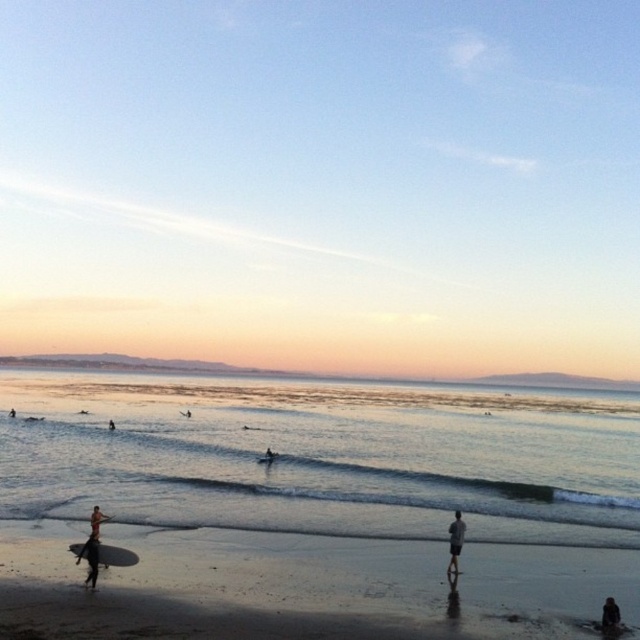
You are standing on the beach and see the dark gray fabric shorts at center and the dark gray wetsuit at lower left. Which object is positioned to the right of the other?

The dark gray fabric shorts at center is to the right of dark gray wetsuit at lower left.

You are standing on the beach and see two points marked on the sand. The first point is at coordinate point(x=272, y=456) and the second is at point(x=113, y=422). Which point is closer to you?

Point(x=272, y=456) is closer to the viewer than point(x=113, y=422).

You are a photographer trying to capture a shot of the dark gray fabric shorts at center and the brown surfboard at lower left. Which object should you focus on first if you want to ensure both are in the frame without moving the camera?

The dark gray fabric shorts at center has a greater height compared to the brown surfboard at lower left, so focusing on the taller object first would help ensure both are in the frame.